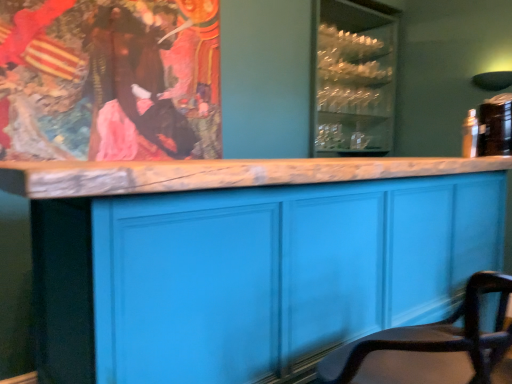
Question: Is smooth leather chair at lower right wider or thinner than brown velvet robe at upper left?

Choices:
 (A) thin
 (B) wide

Answer: (B)

Question: Is smooth leather chair at lower right in front of or behind brown velvet robe at upper left in the image?

Choices:
 (A) behind
 (B) front

Answer: (B)

Question: Estimate the real-world distances between objects in this image. Which object is closer to the brown velvet robe at upper left?

Choices:
 (A) smooth leather chair at lower right
 (B) matte blue cabinet at center
 (C) clear glass cabinet at upper center

Answer: (B)

Question: Which object is positioned farthest from the matte blue cabinet at center?

Choices:
 (A) clear glass cabinet at upper center
 (B) smooth leather chair at lower right
 (C) brown velvet robe at upper left

Answer: (A)